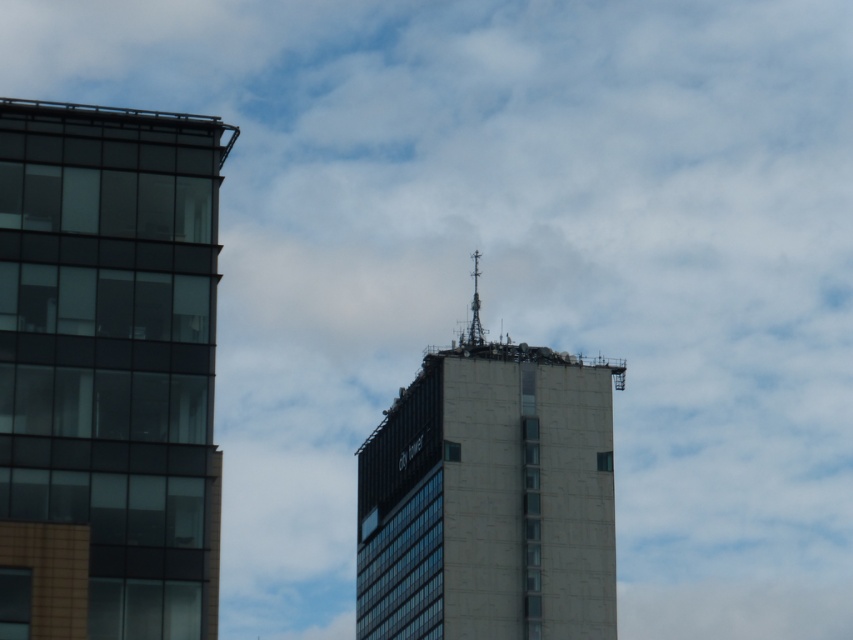
You are an architect analyzing the spatial relationship between the transparent glass building at left and the concrete tower at center. Based on the scene, which building is positioned higher in the image?

The transparent glass building at left is located above the concrete tower at center, so it is positioned higher in the image.

You are standing in front of the two buildings shown in the image. You notice two points marked on the buildings. The first point is at coordinate point(68, 180) and the second is at point(422, 621). Which of these points is nearer to you?

Point(68, 180) is closer to the viewer than point(422, 621).

You are standing at the point with coordinates (x=107, y=371) in the image. Based on the scene description, what type of building are you facing?

The point at coordinates (x=107, y=371) corresponds to the transparent glass building at left, which is a modern building with a facade of dark glass panels, reflecting light and creating a sleek, contemporary appearance.